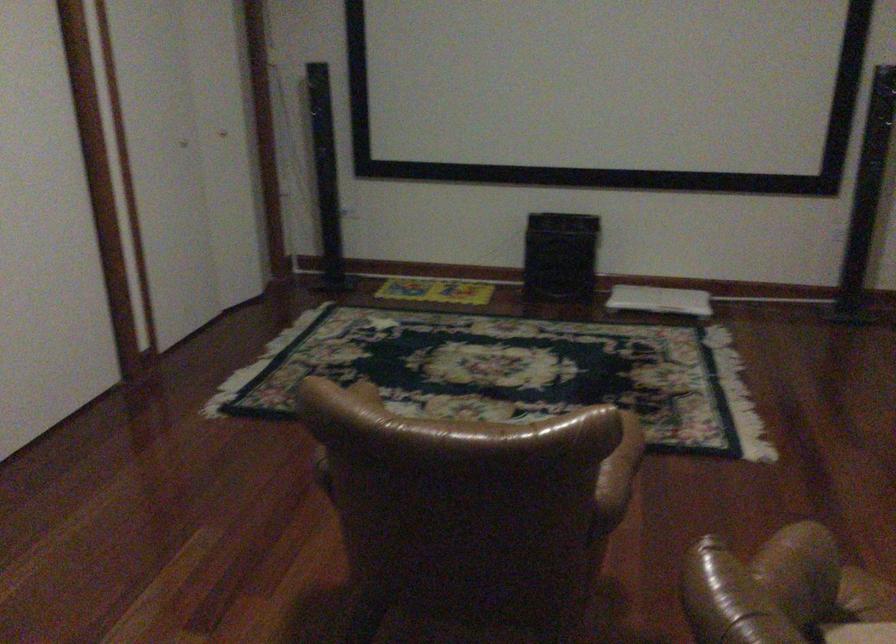
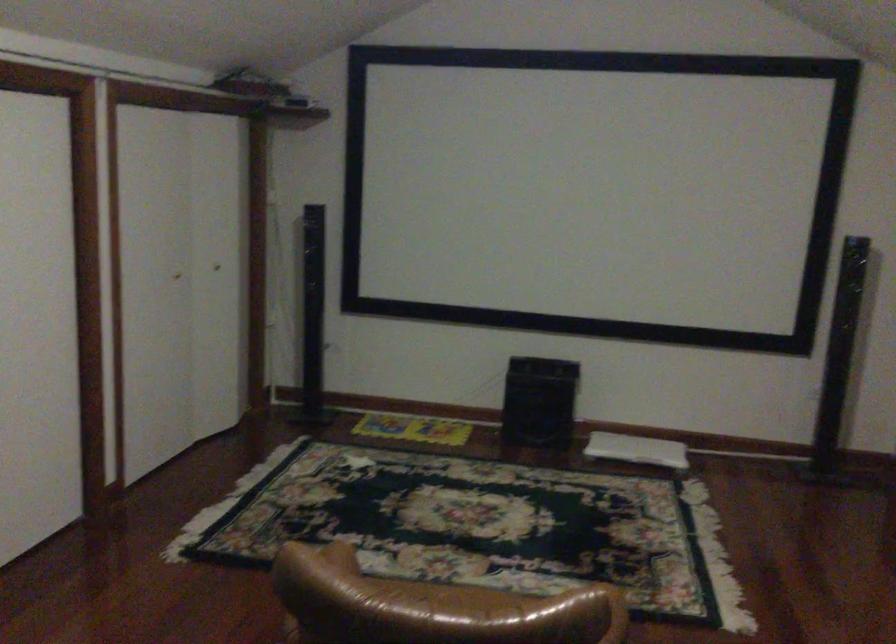
Question: The images are taken continuously from a first-person perspective. In which direction are you moving?

Choices:
 (A) Left
 (B) Right
 (C) Forward
 (D) Backward

Answer: (B)